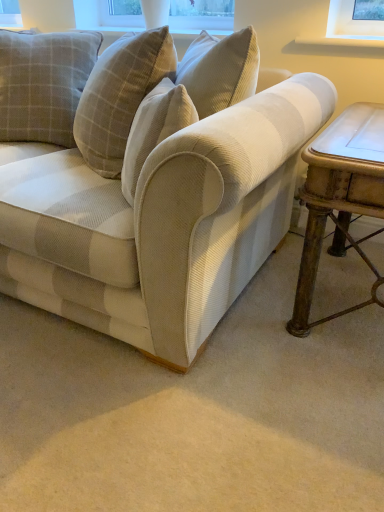
Question: Considering the positions of plaid fabric pillow at upper left and beige corduroy couch at center in the image, is plaid fabric pillow at upper left taller or shorter than beige corduroy couch at center?

Choices:
 (A) short
 (B) tall

Answer: (A)

Question: In terms of width, does plaid fabric pillow at upper left look wider or thinner when compared to beige corduroy couch at center?

Choices:
 (A) wide
 (B) thin

Answer: (B)

Question: Which object is positioned farthest from the beige corduroy couch at center?

Choices:
 (A) plaid fabric pillow at upper left
 (B) rustic wood table at right

Answer: (A)

Question: Which of these objects is positioned farthest from the beige corduroy couch at center?

Choices:
 (A) rustic wood table at right
 (B) plaid fabric pillow at upper left

Answer: (B)